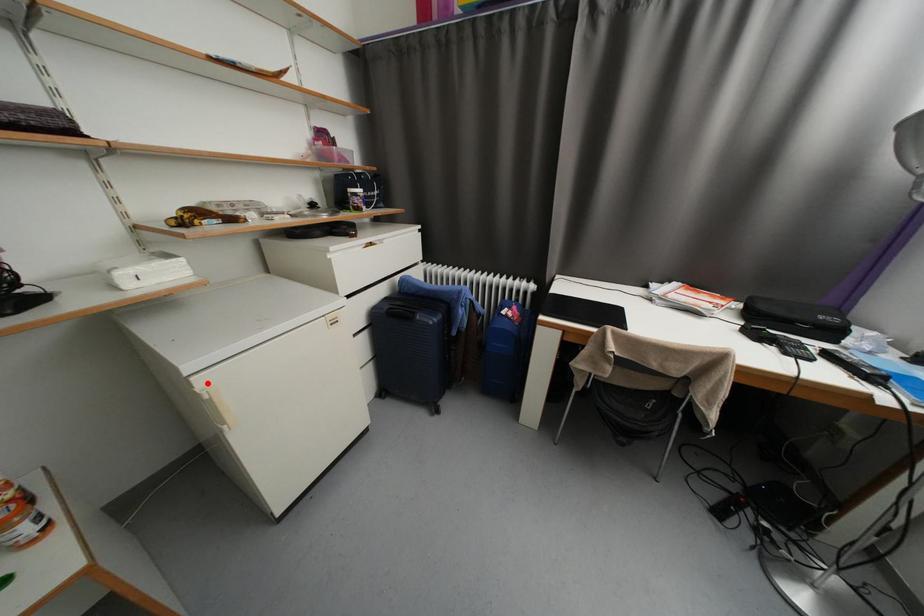
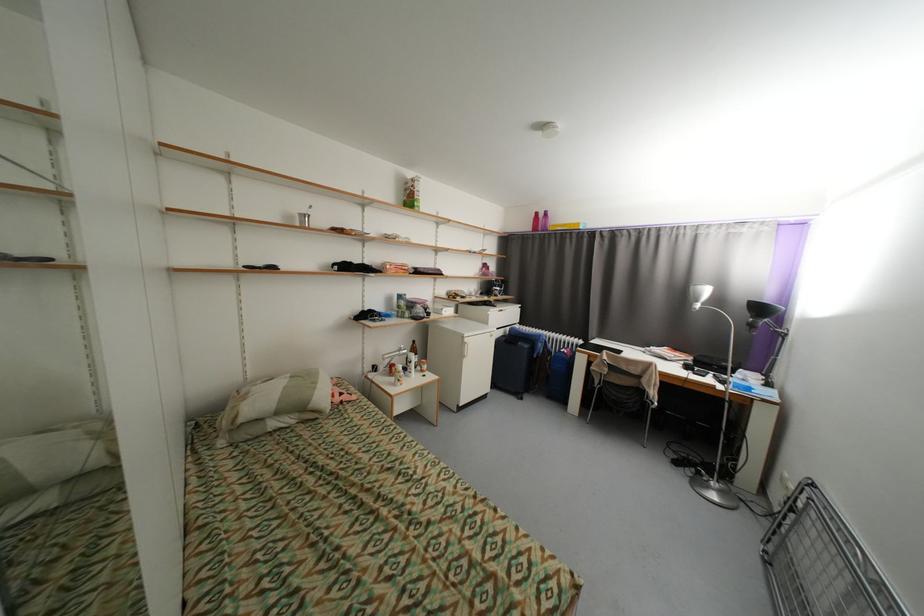
In the second image, find the point that corresponds to the highlighted location in the first image.

(472, 341)